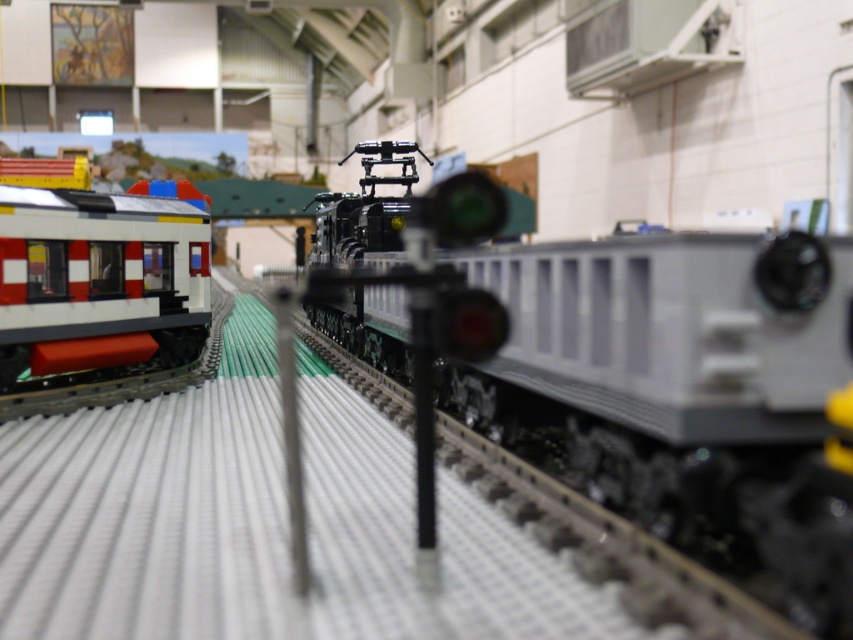
Between matte black train at center and matte black train car at left, which one appears on the right side from the viewer's perspective?

From the viewer's perspective, matte black train at center appears more on the right side.

Does matte black train at center lie behind matte black train car at left?

That is False.

Is point (793, 308) behind point (44, 340)?

That is False.

Identify the location of matte black train at center. (683, 388).